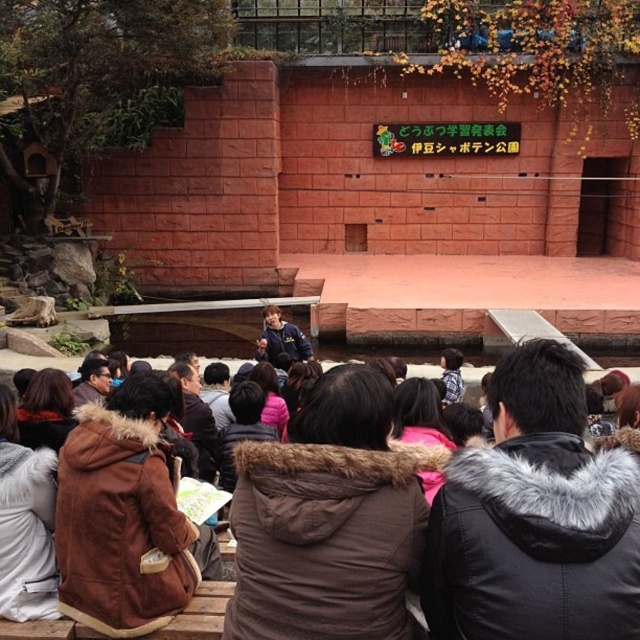
You are standing in the audience area of the outdoor stage scene. There are two points marked in the image. Which point, point (493, 588) or point (481, 561), is closer to you?

Point (493, 588) is closer to the viewer than point (481, 561).